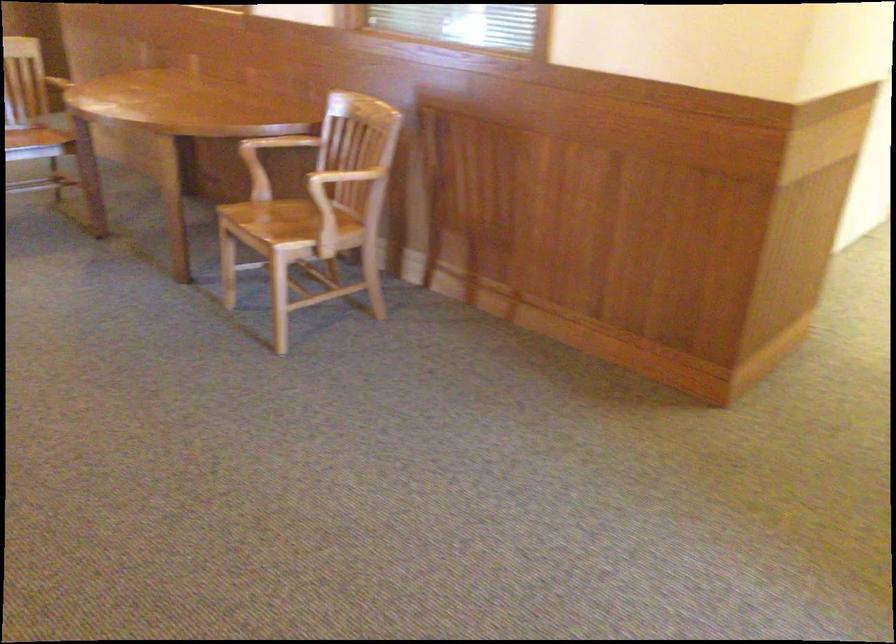
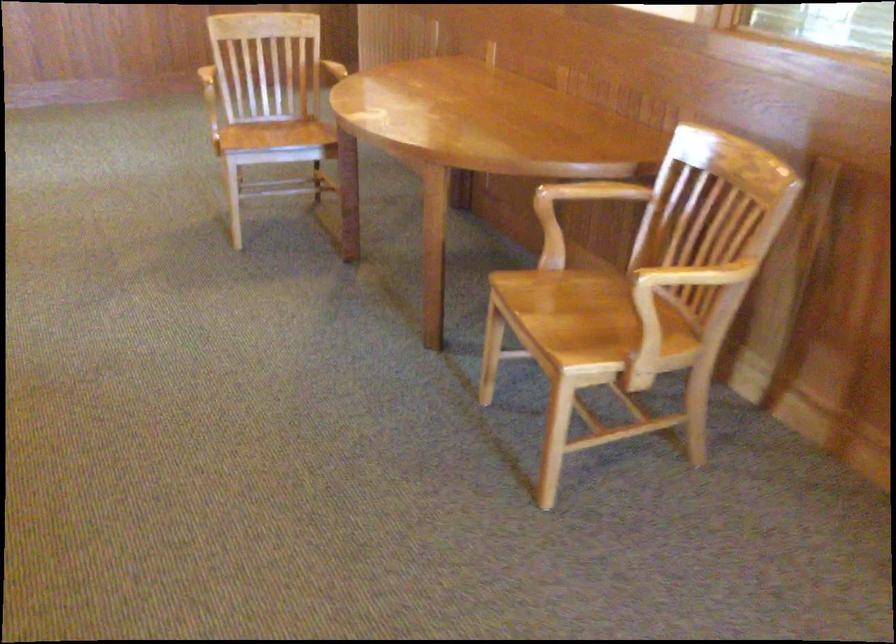
What movement of the cameraman would produce the second image?

The cameraman moved toward left, forward.